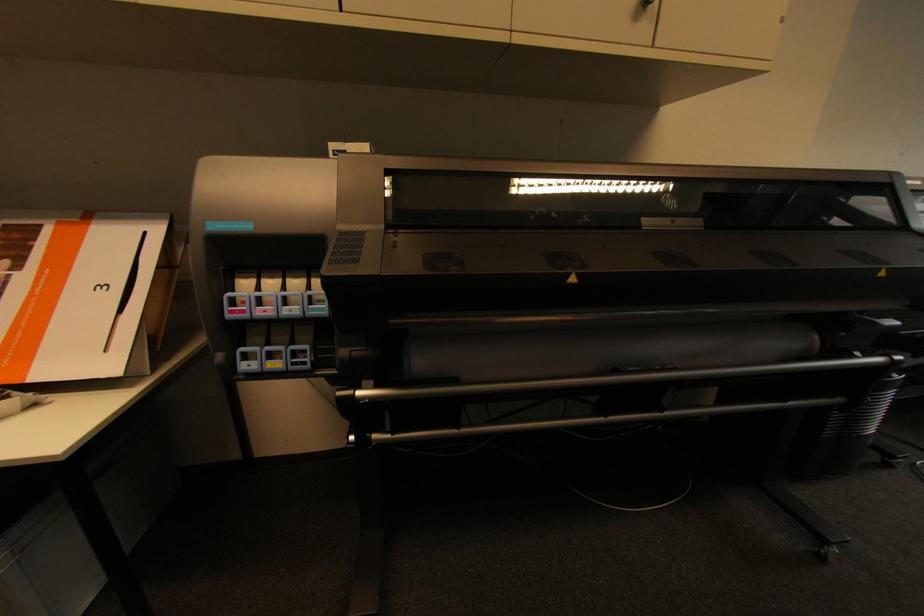
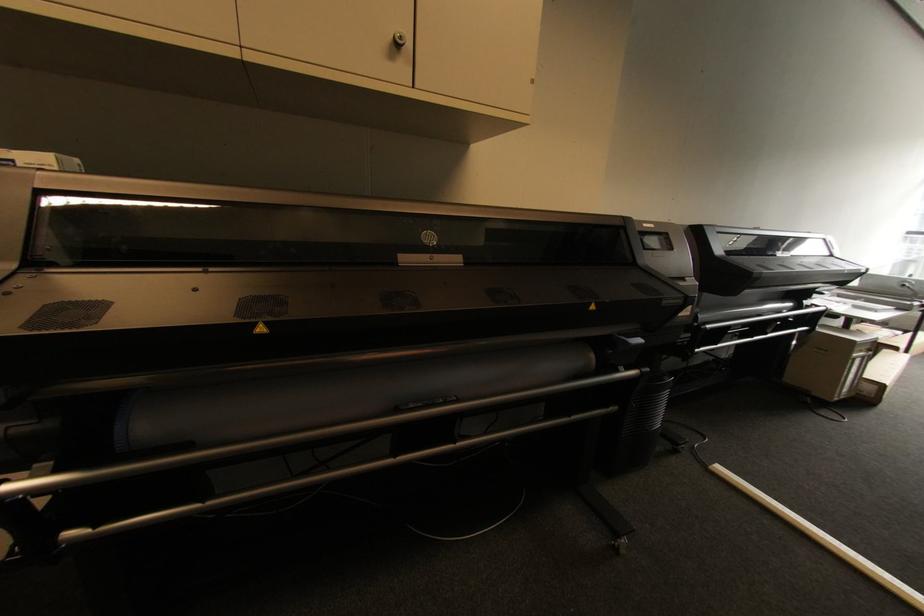
Question: What movement of the cameraman would produce the second image?

Choices:
 (A) Left
 (B) Right
 (C) Forward
 (D) Backward

Answer: (B)